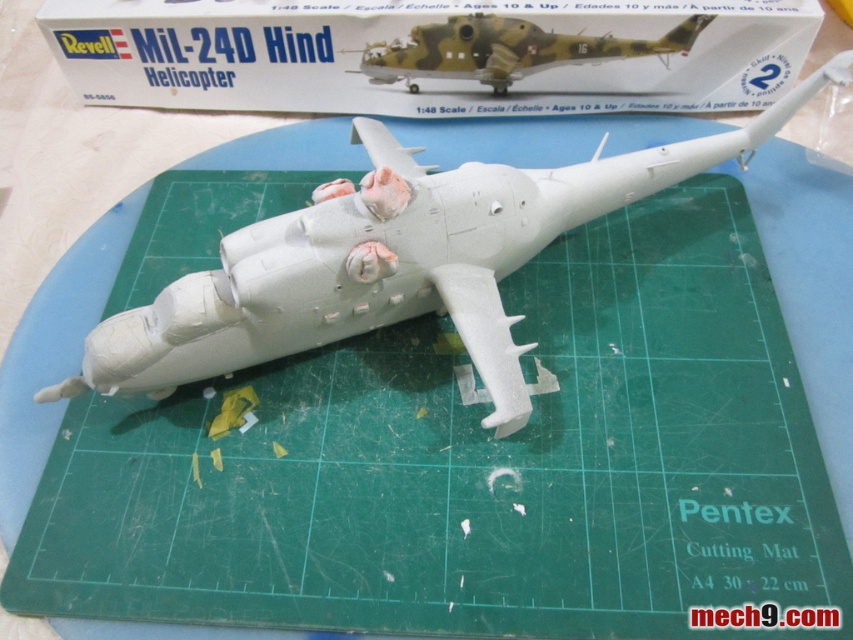
You are a model builder who needs to store both the matte white plastic box at upper center and the camouflage plastic helicopter at center in a storage container. The container has a width limit of 30 cm. Given that the Pentex Cutting Mat is 30x22 cm, can both items fit side by side along the width of the container?

The matte white plastic box at upper center is wider than the camouflage plastic helicopter at center. Since the container has a width limit of 30 cm and the Pentex Cutting Mat is 30 cm wide, the combined width of both items may exceed the container limit. However, without exact measurements, it is uncertain. Please check the total width of both items against the container dimensions.

You are examining the model helicopter and need to determine the order in which to apply decals. The decal for the tail section is at point (518,100), and the decal for the main body is at point (575,54). Which decal should you apply first if you want to start with the part closest to you?

You should apply the decal at point (518,100) first because it is closer to you than the decal at point (575,54).